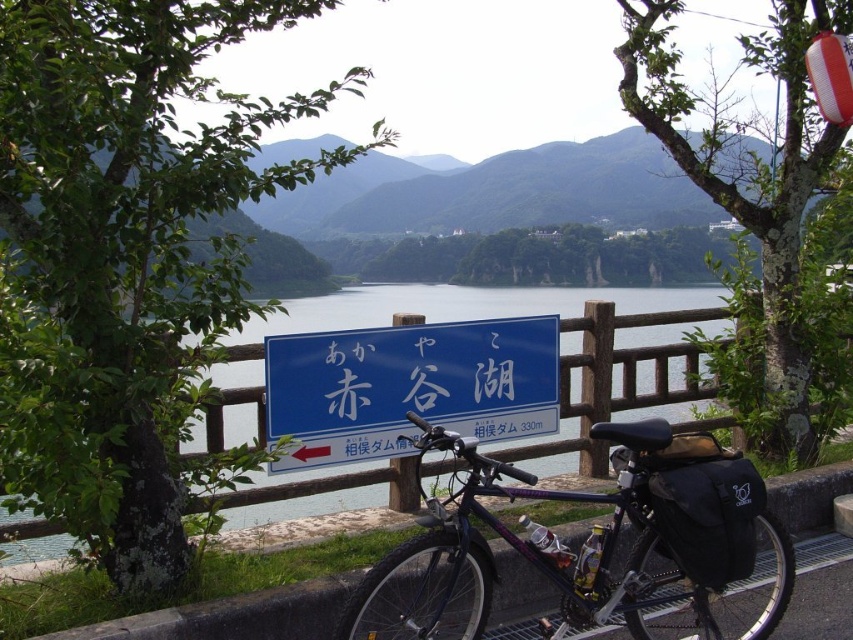
Question: Is metallic purple bicycle at center closer to camera compared to blue plastic sign at center?

Choices:
 (A) yes
 (B) no

Answer: (A)

Question: Among these points, which one is farthest from the camera?

Choices:
 (A) (708, 442)
 (B) (480, 401)

Answer: (B)

Question: Does metallic purple bicycle at center lie behind blue plastic sign at center?

Choices:
 (A) no
 (B) yes

Answer: (A)

Question: Does metallic purple bicycle at center appear on the right side of blue plastic sign at center?

Choices:
 (A) no
 (B) yes

Answer: (B)

Question: Which of the following is the farthest from the observer?

Choices:
 (A) (540, 628)
 (B) (479, 358)

Answer: (B)

Question: Which object is closer to the camera taking this photo?

Choices:
 (A) metallic purple bicycle at center
 (B) blue plastic sign at center

Answer: (A)